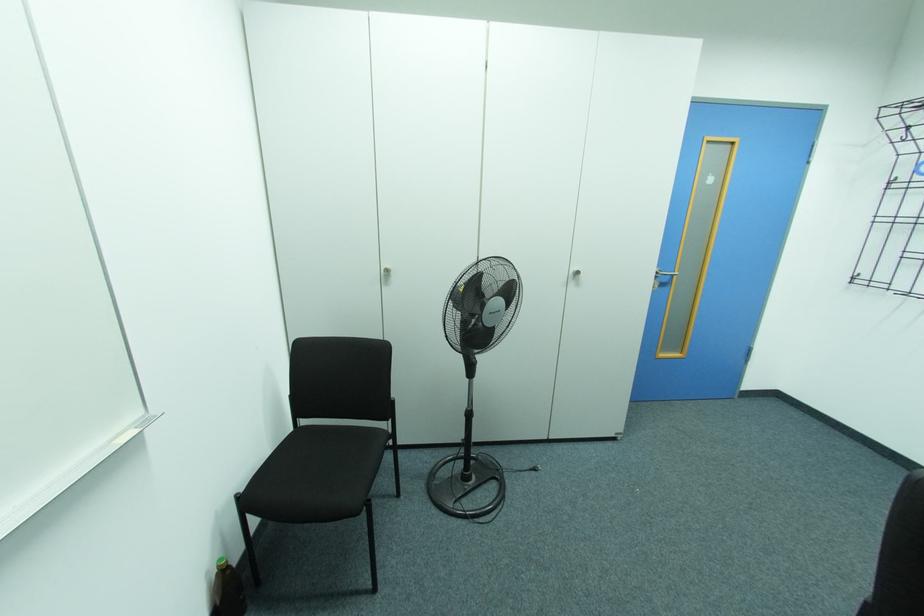
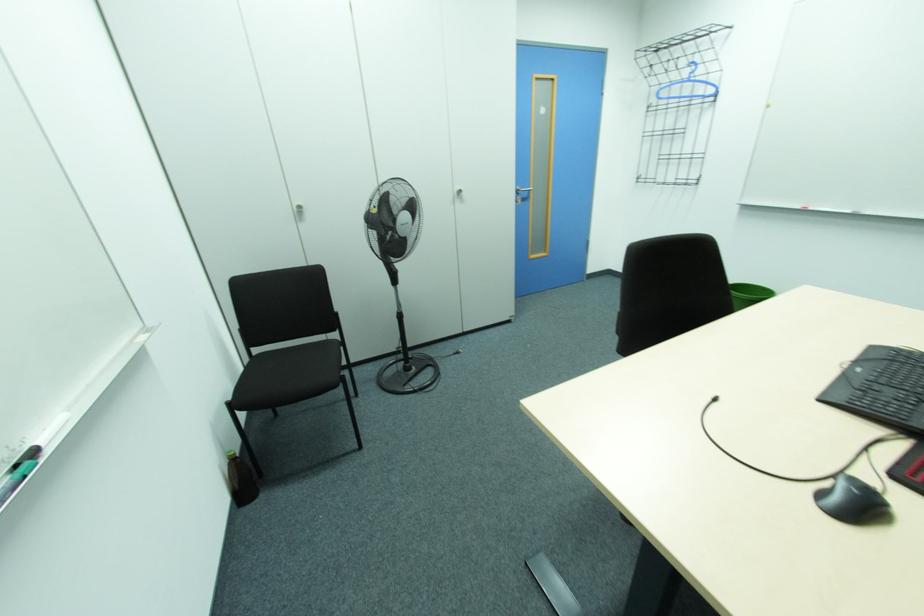
Which direction would the cameraman need to move to produce the second image?

The cameraman walked toward left, backward.